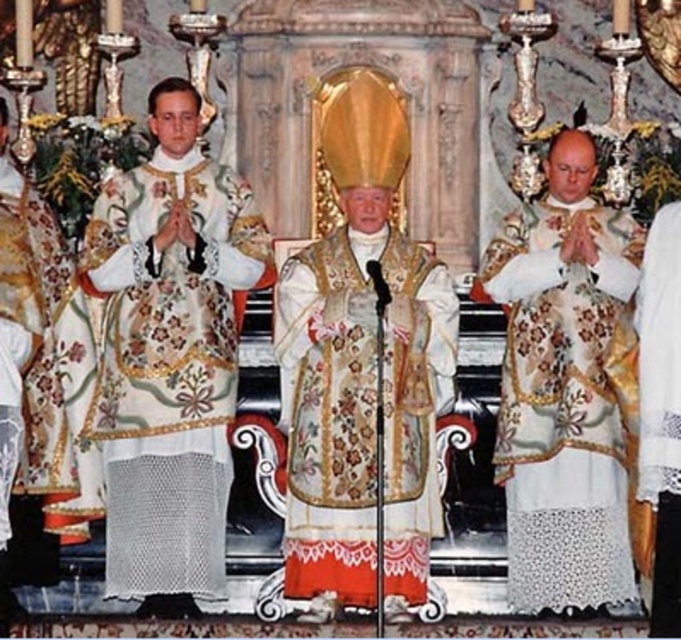
You are attending the ceremony and need to locate the white lace robe at center. Based on the coordinates provided in the Objects Description, can you determine its position relative to the edges of the image?

The white lace robe at center is located at coordinates point [567,406], which means it is positioned approximately 63.7 percent from the left edge and 83.4 percent from the top edge of the image.

Based on the scene description, which object is bigger between the white embroidered robe at center and the embroidered silk vestment at center?

The white embroidered robe at center is larger in size compared to the embroidered silk vestment at center.

From the picture: Based on the scene description, where is the white embroidered robe at left located in the image? Please provide the coordinates mentioned in the description.

The white embroidered robe at left is located at coordinates point (22, 337).